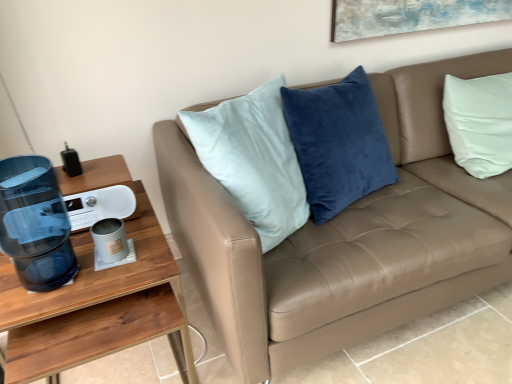
The width and height of the screenshot is (512, 384). Identify the location of vacant space in front of transparent plastic water cooler at left. (35, 304).